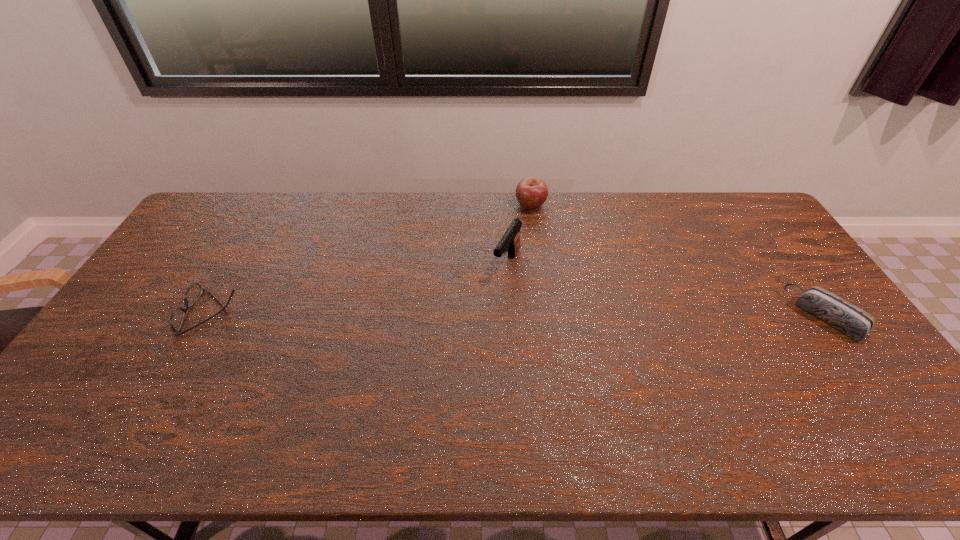
Where is `vacant space on the desktop that is between the leftmost object and the second shortest object and is positioned on the side of the third shortest object with the unique marking`? This screenshot has width=960, height=540. vacant space on the desktop that is between the leftmost object and the second shortest object and is positioned on the side of the third shortest object with the unique marking is located at coordinates (492, 314).

The height and width of the screenshot is (540, 960). Find the location of `free space on the desktop that is between the leftmost object and the third tallest object and is positioned at the barrel of the tallest object`. free space on the desktop that is between the leftmost object and the third tallest object and is positioned at the barrel of the tallest object is located at coordinates (477, 314).